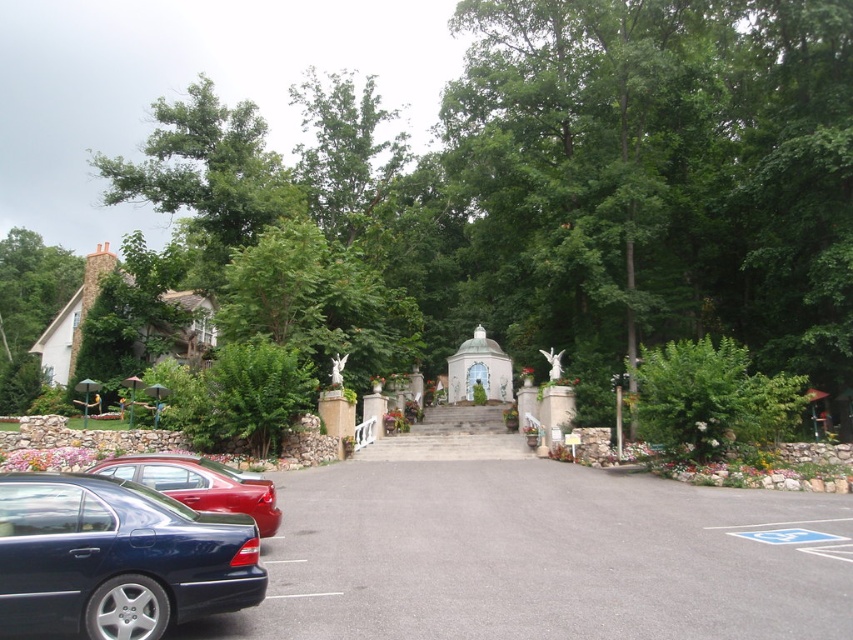
Question: Considering the real-world distances, which object is farthest from the green leafy tree at upper left?

Choices:
 (A) white stone steps at center
 (B) green leafy tree at center

Answer: (A)

Question: Considering the relative positions of green leafy tree at center and green leafy tree at upper left in the image provided, where is green leafy tree at center located with respect to green leafy tree at upper left?

Choices:
 (A) above
 (B) below

Answer: (A)

Question: Does green leafy tree at center have a greater width compared to shiny blue sedan at lower left?

Choices:
 (A) no
 (B) yes

Answer: (B)

Question: Does green leafy tree at center have a lesser width compared to white stone steps at center?

Choices:
 (A) yes
 (B) no

Answer: (B)

Question: Which of these objects is positioned closest to the green leafy tree at upper left?

Choices:
 (A) shiny blue sedan at lower left
 (B) green leafy tree at center
 (C) shiny red sedan at center
 (D) white stone steps at center

Answer: (B)

Question: Estimate the real-world distances between objects in this image. Which object is farther from the white stone steps at center?

Choices:
 (A) shiny red sedan at center
 (B) green leafy tree at upper left

Answer: (B)